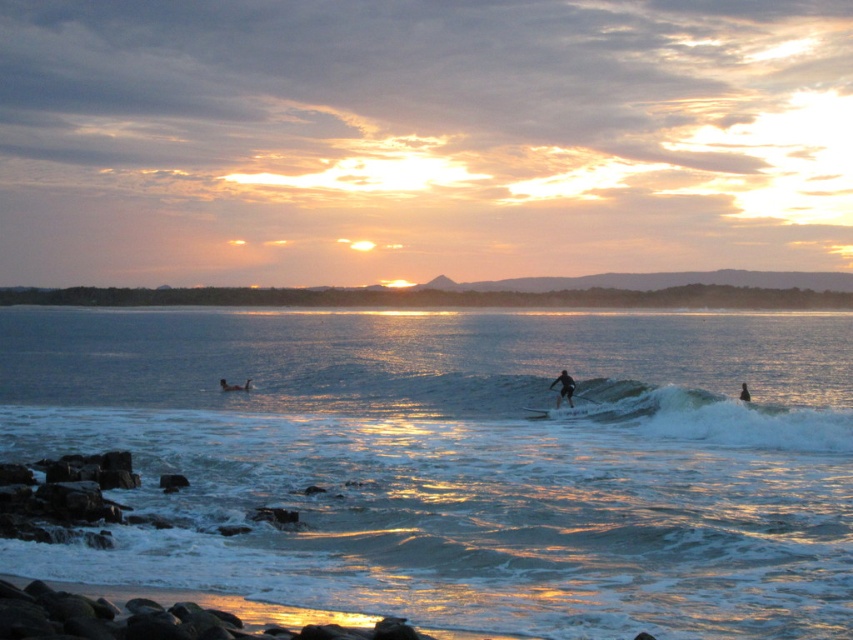
From the picture: You are a photographer planning to capture the sunset at the coast. You notice the white foam surfboard at center and the dark blue wetsuit at lower right. Which object should you focus on if you want to highlight something that is smaller in size?

The white foam surfboard at center has a smaller size compared to the dark blue wetsuit at lower right, so you should focus on the white foam surfboard at center to highlight the smaller object.